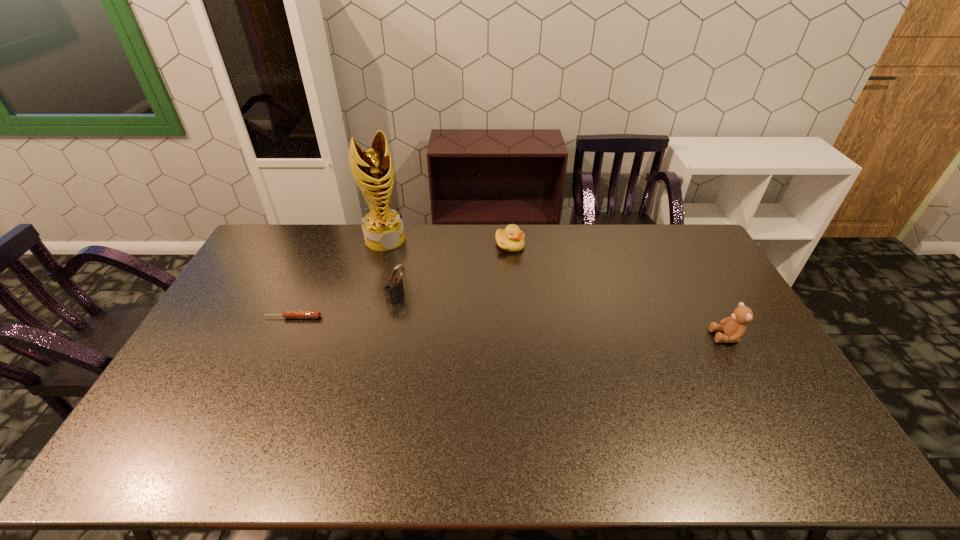
The width and height of the screenshot is (960, 540). In order to click on the leftmost object in this screenshot , I will do `click(287, 314)`.

You are a GUI agent. You are given a task and a screenshot of the screen. Output one action in this format:
    pyautogui.click(x=<x>, y=<y>)
    Task: Click on the fourth farthest object
    
    Given the screenshot: What is the action you would take?
    pyautogui.click(x=287, y=314)

In order to click on the rightmost object in this screenshot , I will do `click(734, 327)`.

The height and width of the screenshot is (540, 960). What are the coordinates of `the nearest object` in the screenshot? It's located at (734, 327).

This screenshot has width=960, height=540. Identify the location of the third nearest object. (394, 290).

Locate an element on the screen. This screenshot has height=540, width=960. the fourth tallest object is located at coordinates (511, 239).

Where is `duckling`? This screenshot has width=960, height=540. duckling is located at coordinates (511, 239).

Where is `the tallest object`? The width and height of the screenshot is (960, 540). the tallest object is located at coordinates (383, 229).

Where is `free space located on the right of the sausage`? free space located on the right of the sausage is located at coordinates (369, 318).

You are a GUI agent. You are given a task and a screenshot of the screen. Output one action in this format:
    pyautogui.click(x=<x>, y=<y>)
    Task: Click on the free location located 0.120m on the face of the rightmost object
    This screenshot has height=540, width=960.
    Given the screenshot: What is the action you would take?
    pyautogui.click(x=672, y=336)